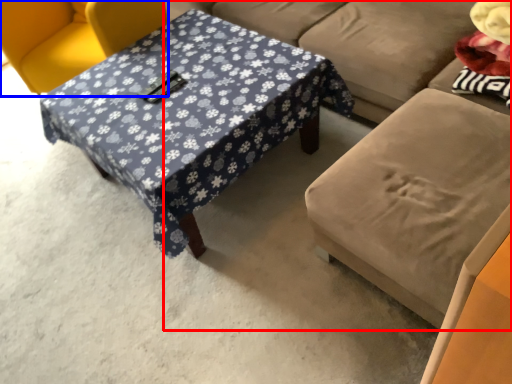
Question: Which object is further to the camera taking this photo, studio couch (highlighted by a red box) or chair (highlighted by a blue box)?

Choices:
 (A) studio couch
 (B) chair

Answer: (B)